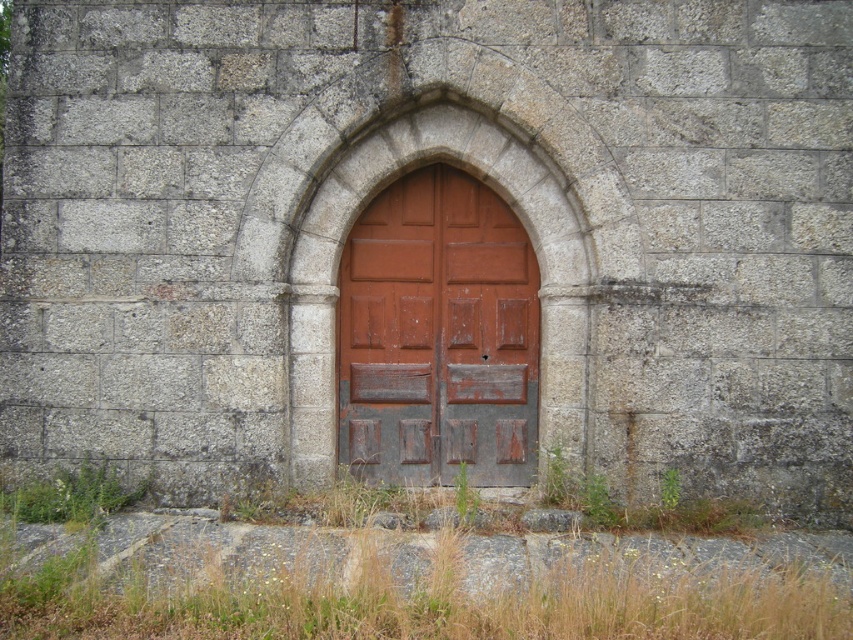
In the scene shown: You are standing in front of the weathered stone wall with an arched doorway. There is a point marked at coordinates (438, 337). Based on the scene description, what object is located at that point?

The point at (438, 337) marks the rustic wood door at center.

You are a painter hired to paint the rustic wood door at center and the green grassy weed at lower left. You have a limited amount of paint. Which object requires more paint due to its size?

The rustic wood door at center requires more paint because it is bigger than the green grassy weed at lower left.